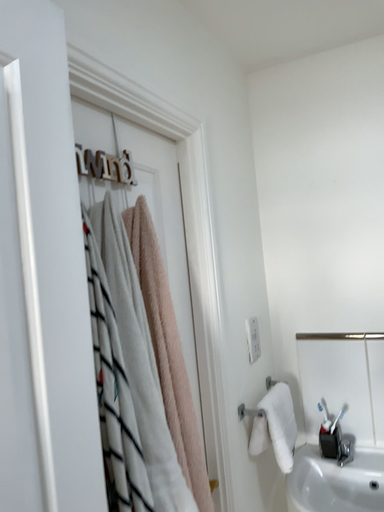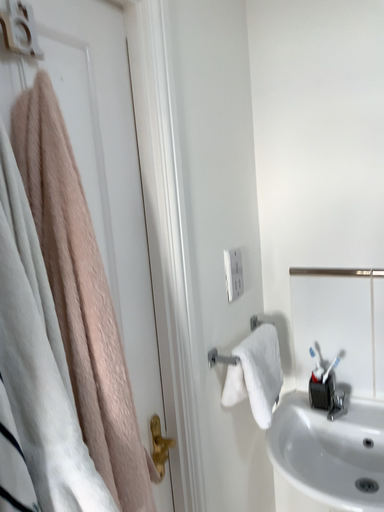
Question: Which way did the camera rotate in the video?

Choices:
 (A) rotated downward
 (B) rotated upward

Answer: (A)